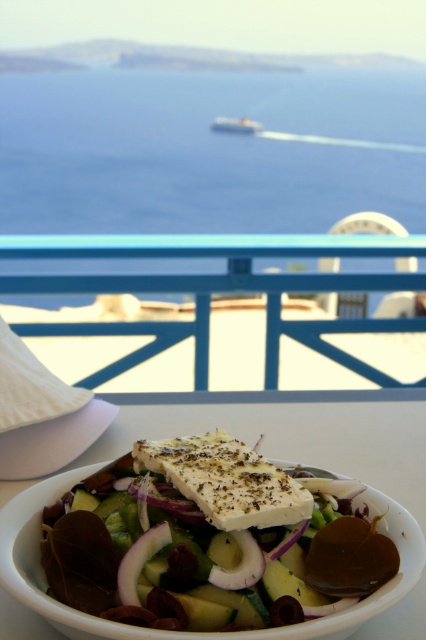
Who is lower down, blue painted wood rail at upper center or metallic silver boat at upper center?

blue painted wood rail at upper center is lower down.

Can you confirm if blue painted wood rail at upper center is thinner than metallic silver boat at upper center?

Incorrect, blue painted wood rail at upper center's width is not less than metallic silver boat at upper center's.

Which is behind, point (336, 284) or point (242, 120)?

Positioned behind is point (242, 120).

Identify the location of blue painted wood rail at upper center. (216, 289).

Is blue water at center above metallic silver boat at upper center?

Actually, blue water at center is below metallic silver boat at upper center.

Where is `blue water at center`? The image size is (426, 640). blue water at center is located at coordinates (207, 150).

Who is lower down, blue water at center or white ceramic bowl at center?

white ceramic bowl at center is below.

Is blue water at center taller than white ceramic bowl at center?

Yes.

Who is more forward, (391, 196) or (420, 454)?

Point (420, 454) is in front.

Image resolution: width=426 pixels, height=640 pixels. Identify the location of blue water at center. (207, 150).